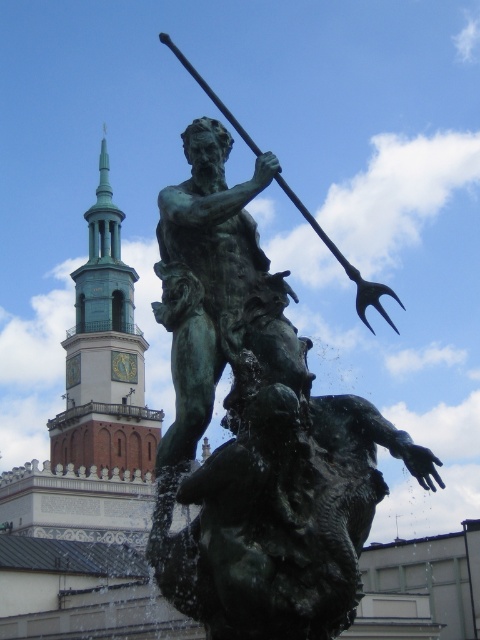
You are an art conservator assessing the scene. You need to inspect both the green patina bronze statue at center and the green patina tower at upper left. Which object is positioned closer to your current viewpoint?

The green patina bronze statue at center is closer to the viewer than the green patina tower at upper left.

You are standing at the base of the clock tower and want to take a photo of the statue. There are two points marked on the ground where you can stand to frame the statue properly. The first point is at coordinates point (207, 301) and the second is at point (119, 429). Which point should you choose to ensure the statue is closer to the camera?

Point (207, 301) is in front of point (119, 429), so choosing point (207, 301) will place you closer to the statue, ensuring it appears larger in the photo.

You are a drone operator tasked with capturing aerial footage of the green patina bronze statue at center and the green patina tower at upper left. Your drone has a maximum flight range of 120 meters. Can the drone safely capture footage of both objects without needing to recharge or return to base?

The distance between the green patina bronze statue at center and the green patina tower at upper left is 111.36 meters. Since this is under the drone operator drone maximum flight range of 120 meters, the drone can safely capture footage of both objects without needing to recharge or return to base.